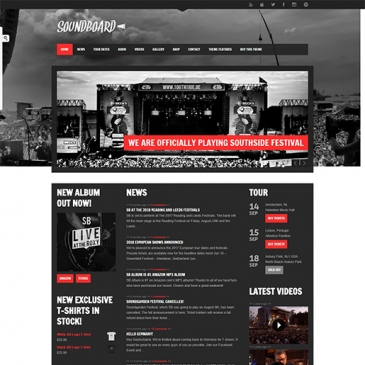
Identify the location of lighting. The image size is (365, 365). (155, 112), (181, 112), (207, 111).